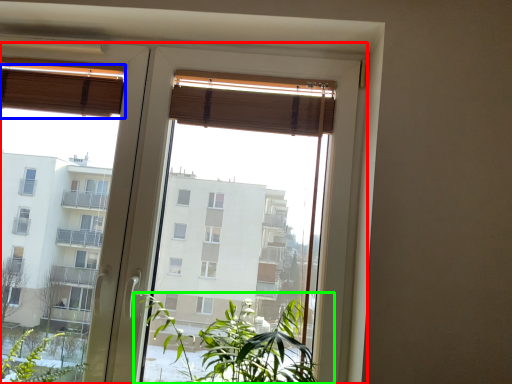
Question: Which object is the farthest from window (highlighted by a red box)? Choose among these: curtain (highlighted by a blue box) or houseplant (highlighted by a green box).

Choices:
 (A) curtain
 (B) houseplant

Answer: (B)